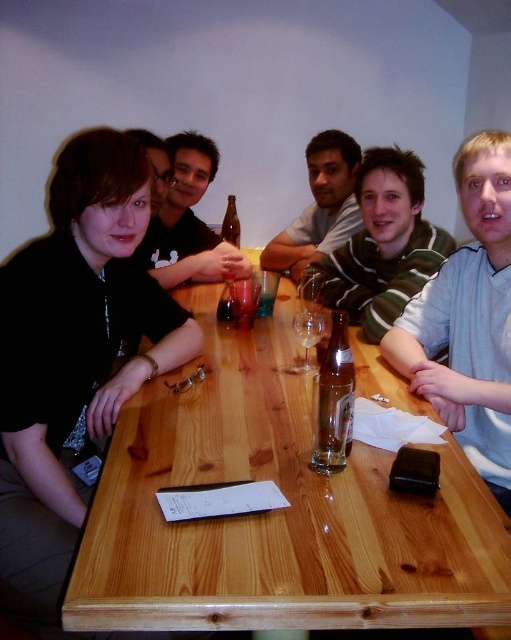
Question: Which object appears farthest from the camera in this image?

Choices:
 (A) matte gray shirt at center
 (B) green striped shirt at center
 (C) brown glass bottle at center
 (D) black matte shirt at left

Answer: (C)

Question: Considering the real-world distances, which object is closest to the matte black shirt at center?

Choices:
 (A) green striped shirt at center
 (B) clear glass bottle at center

Answer: (A)

Question: Is striped cotton shirt at right smaller than brown glass bottle at center?

Choices:
 (A) yes
 (B) no

Answer: (B)

Question: Is black matte shirt at left further to the viewer compared to green striped shirt at center?

Choices:
 (A) no
 (B) yes

Answer: (A)

Question: Which object is the closest to the brown glass bottle at center?

Choices:
 (A) matte black shirt at center
 (B) green striped shirt at center
 (C) light brown wood table at center

Answer: (A)

Question: Observing the image, what is the correct spatial positioning of black matte shirt at left in reference to brown glass bottle at center?

Choices:
 (A) above
 (B) below

Answer: (B)